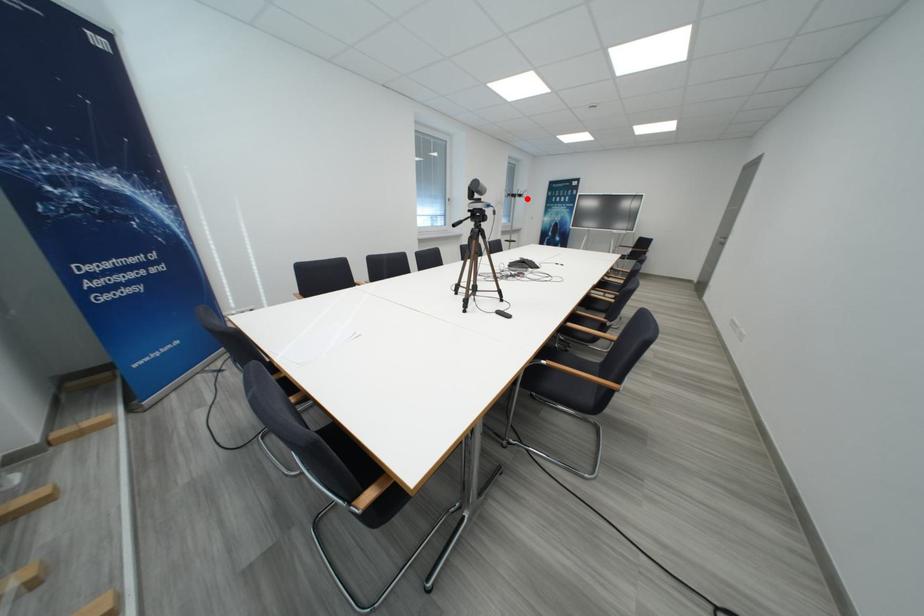
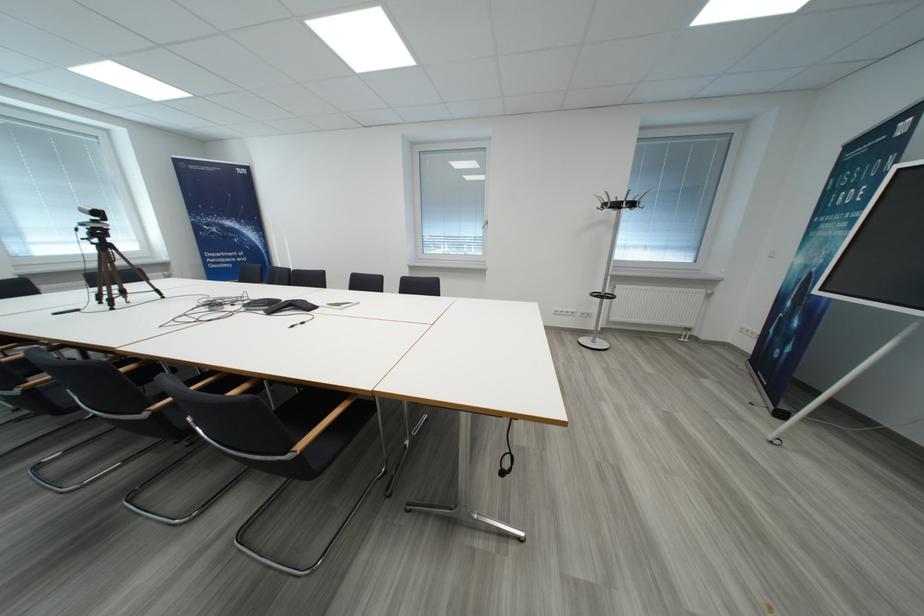
Question: I am providing you with two images of the same scene from different viewpoints. In image1, a red point is highlighted. Considering the same 3D point in image2, which of the following is correct?

Choices:
 (A) It is closer
 (B) It is farther

Answer: (B)